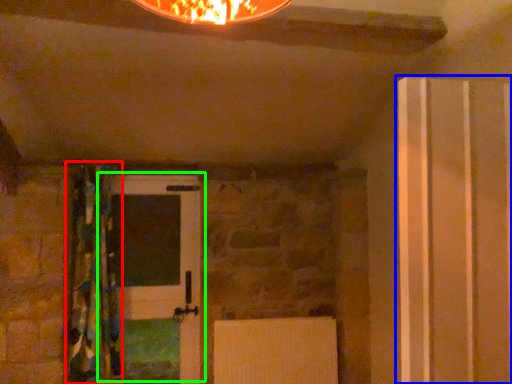
Question: Which object is the farthest from curtain (highlighted by a red box)? Choose among these: door (highlighted by a blue box) or door (highlighted by a green box).

Choices:
 (A) door
 (B) door

Answer: (A)